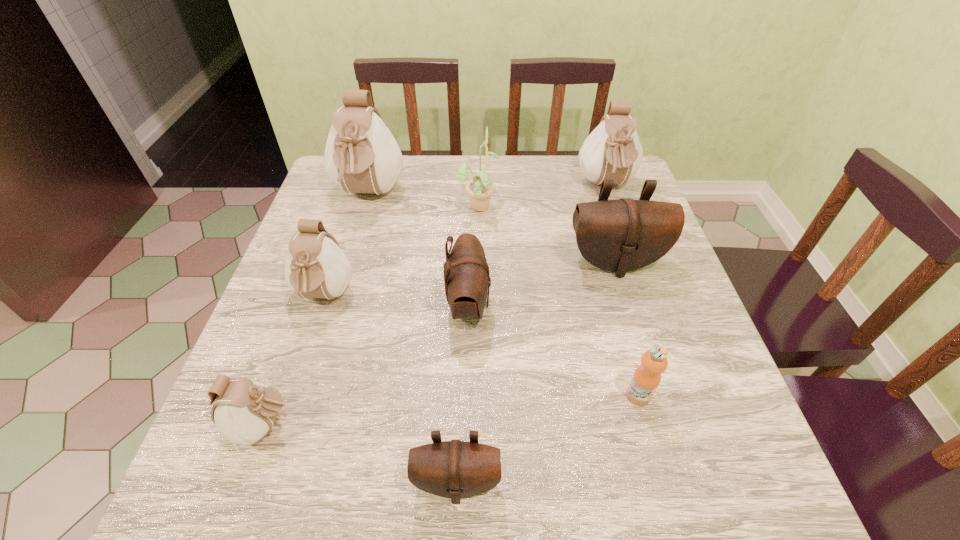
What are the coordinates of `free space that satisfies the following two spatial constraints: 1. on the front-facing side of the sunflower; 2. on the front-facing side of the third farthest white pouch` in the screenshot? It's located at (478, 296).